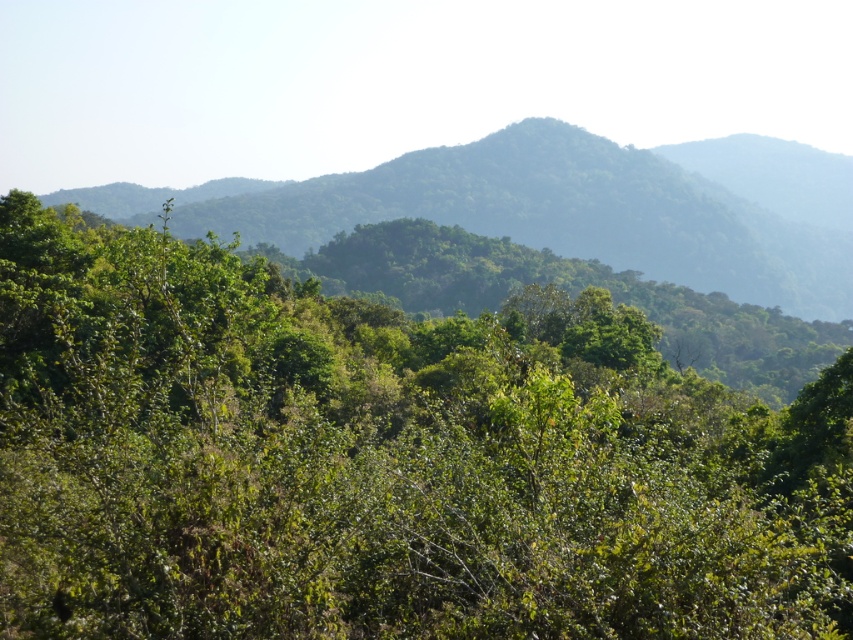
You are an environmental scientist studying the landscape. You observe the green leafy tree at center and the green leafy mountain at center. Which one has a narrower width?

The green leafy tree at center is thinner than the green leafy mountain at center, so the green leafy tree at center has a narrower width.